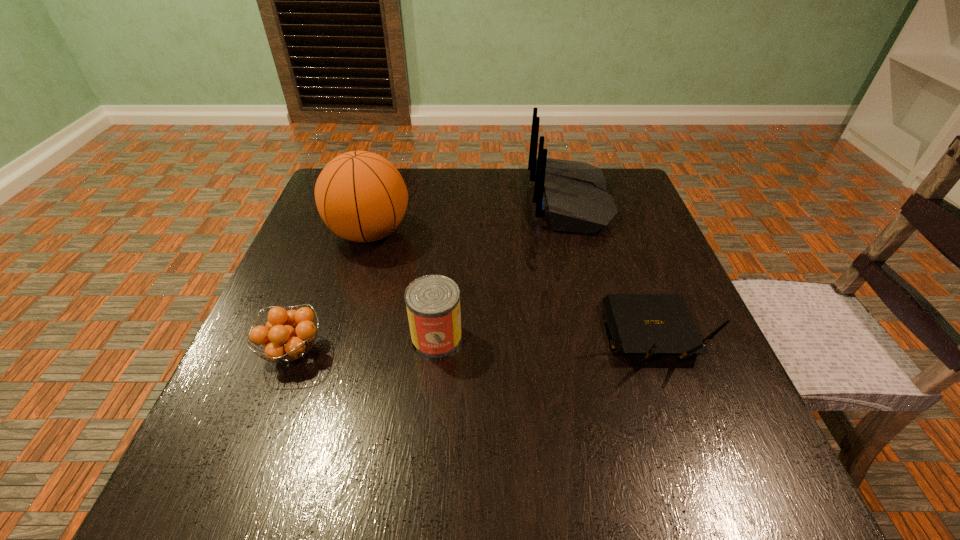
The width and height of the screenshot is (960, 540). What are the coordinates of `free spot located on the front of the third object from left to right` in the screenshot? It's located at (428, 426).

Where is `vacant space located on the back of the nearer router`? Image resolution: width=960 pixels, height=540 pixels. vacant space located on the back of the nearer router is located at coordinates (598, 193).

Locate an element on the screen. Image resolution: width=960 pixels, height=540 pixels. free spot located on the back of the orange fruit is located at coordinates (348, 207).

Identify the location of router that is at the far edge. This screenshot has height=540, width=960. (572, 195).

Where is `basketball at the far edge`? The image size is (960, 540). basketball at the far edge is located at coordinates (361, 196).

This screenshot has height=540, width=960. Find the location of `basketball situated at the left edge`. basketball situated at the left edge is located at coordinates (361, 196).

Find the location of `orange fruit located at the left edge`. orange fruit located at the left edge is located at coordinates (281, 340).

I want to click on object at the far left corner, so click(361, 196).

Identify the location of object that is positioned at the far right corner. (572, 195).

Where is `vacant space at the far edge of the desktop`? This screenshot has width=960, height=540. vacant space at the far edge of the desktop is located at coordinates (529, 178).